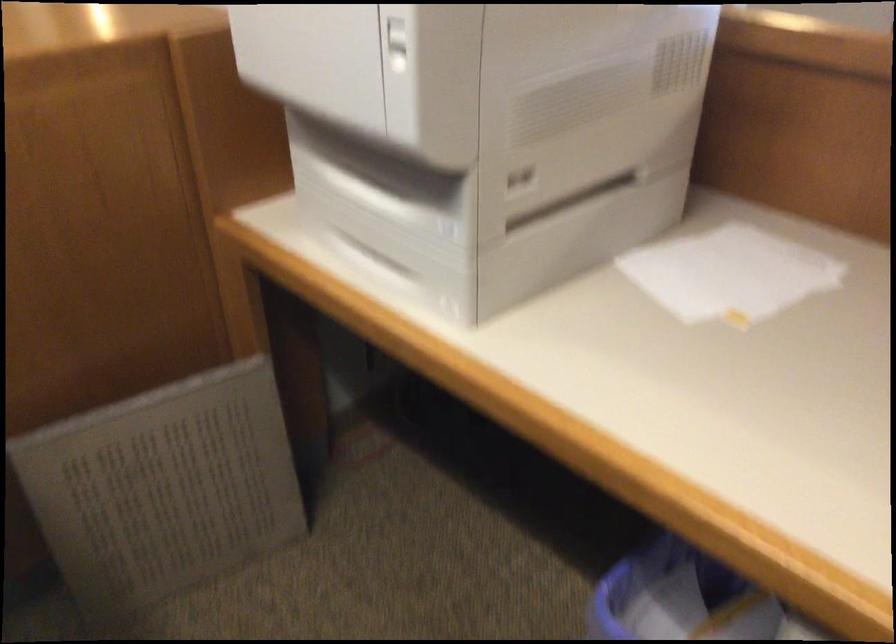
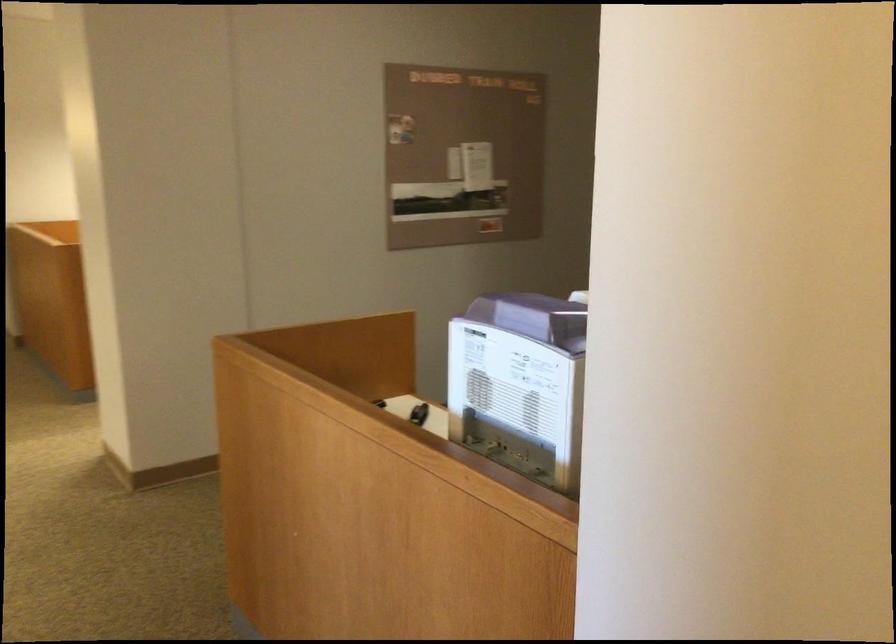
Question: I am providing you with two images of the same scene from different viewpoints. After the viewpoint changes to image2, which objects are now occluded?

Choices:
 (A) small black object
 (B) golden aluminum can
 (C) white power button
 (D) purple machine lid

Answer: (C)